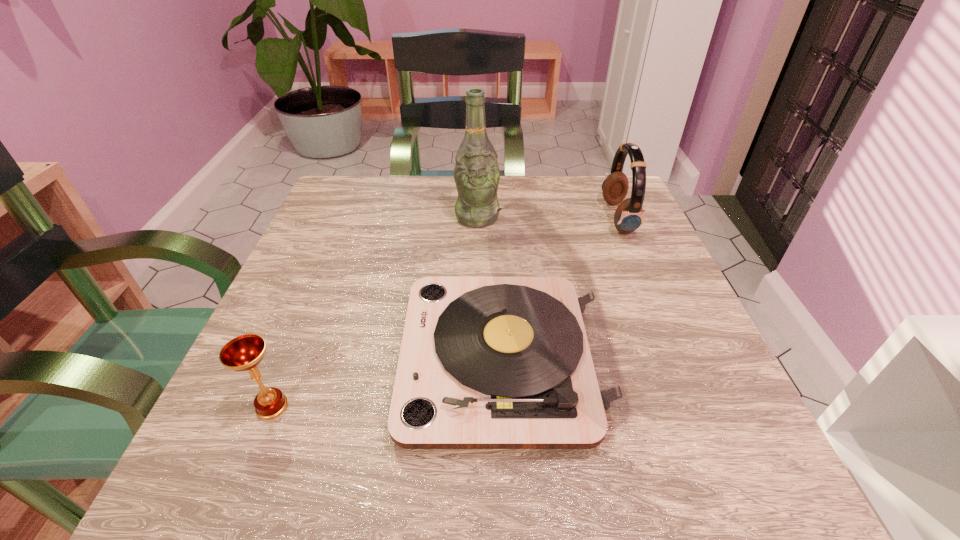
Where is `vacant space located on the ear cup of the rightmost object`? vacant space located on the ear cup of the rightmost object is located at coordinates (448, 218).

This screenshot has width=960, height=540. In order to click on vacant space located 0.340m on the ear cup of the rightmost object in this screenshot , I will do `click(457, 218)`.

In order to click on free space located 0.190m on the ear cup of the rightmost object in this screenshot , I will do `click(522, 218)`.

Where is `free space located 0.100m on the front of the chalice`? free space located 0.100m on the front of the chalice is located at coordinates (236, 497).

Locate an element on the screen. beer bottle that is positioned at the far edge is located at coordinates (476, 173).

This screenshot has width=960, height=540. In order to click on headset that is at the far edge in this screenshot , I will do `click(629, 215)`.

Image resolution: width=960 pixels, height=540 pixels. Identify the location of object at the near edge. (524, 359).

The height and width of the screenshot is (540, 960). Find the location of `object present at the left edge`. object present at the left edge is located at coordinates (244, 353).

The image size is (960, 540). In order to click on object that is at the right edge in this screenshot , I will do `click(629, 215)`.

Find the location of `object that is at the far right corner`. object that is at the far right corner is located at coordinates (629, 215).